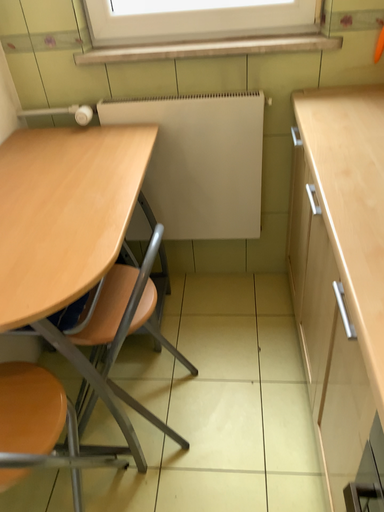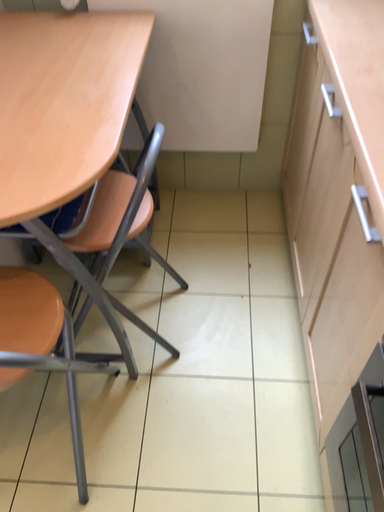
Question: How did the camera likely rotate when shooting the video?

Choices:
 (A) rotated downward
 (B) rotated upward

Answer: (A)